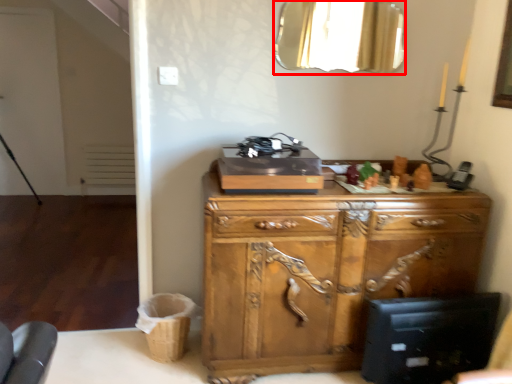
Question: From the image's perspective, where is mirror (annotated by the red box) located relative to chest of drawers?

Choices:
 (A) below
 (B) above

Answer: (B)